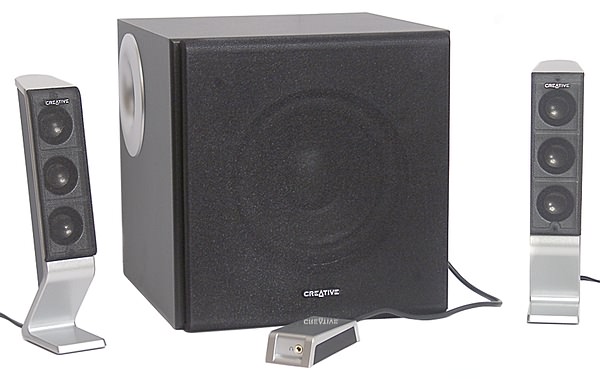
The width and height of the screenshot is (600, 379). Identify the location of 3 circles on right speaker. [560, 143], [547, 99], [556, 198].